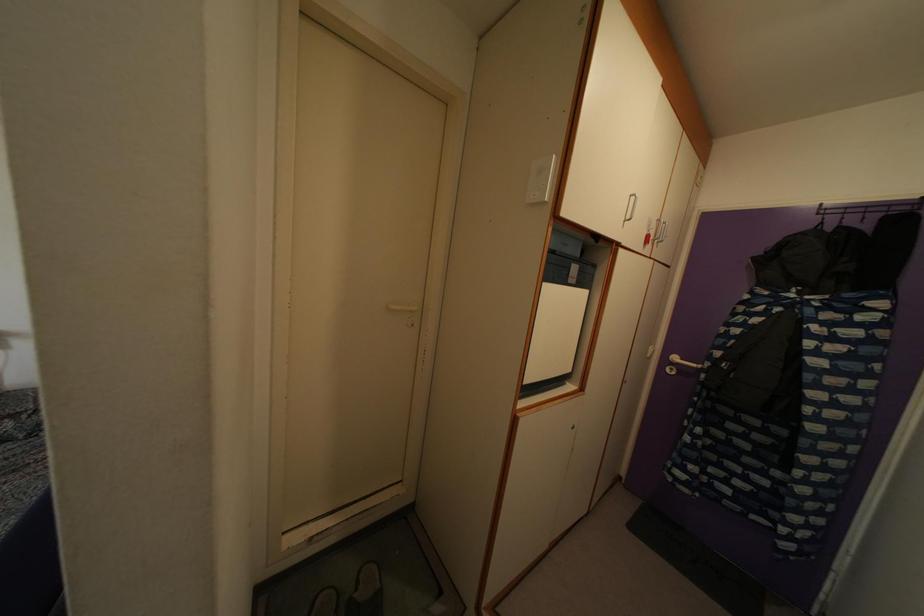
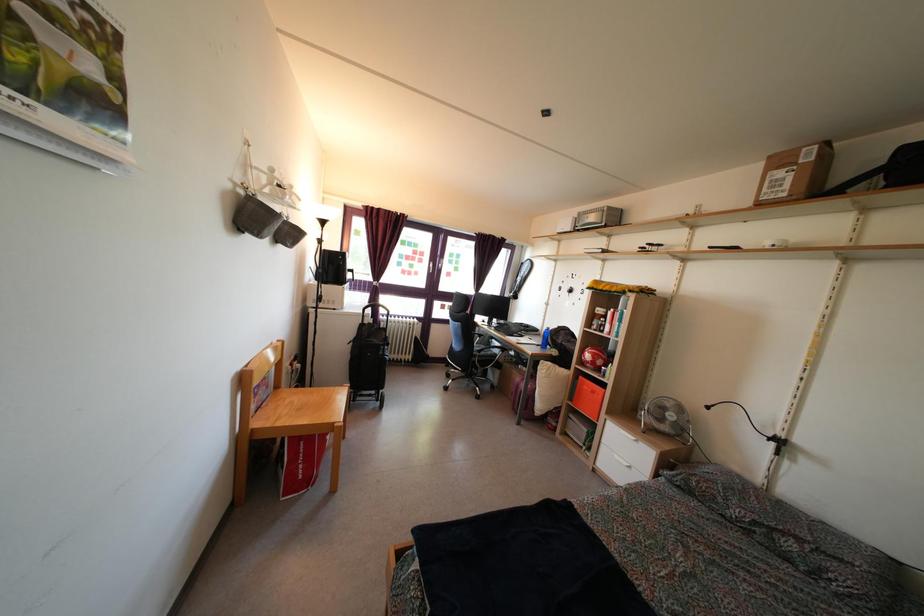
Question: Based on the continuous images, in which direction is the camera rotating? Reply with the corresponding letter.

Choices:
 (A) Left
 (B) Right
 (C) Up
 (D) Down

Answer: (A)